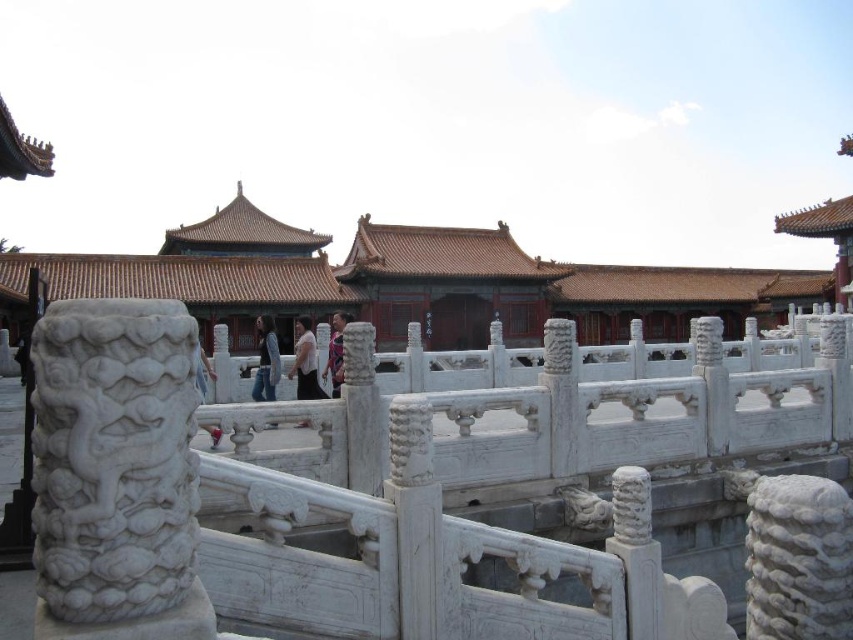
You are a photographer planning to take a photo of the dark blue jeans at center and the matte pink dress at center in this historical setting. Which object should you focus on first to ensure both are in the frame without moving the camera?

You should focus on the dark blue jeans at center first because it is in front of the matte pink dress at center, ensuring both will be captured in the frame without needing to adjust the camera position.

You are standing on the raised platform in front of the historical palace complex. You notice two points marked on the ground at coordinates point (318, 387) and point (267, 346). Which point is closer to you?

Point (318, 387) is closer to the viewer than point (267, 346).

You are a tourist visiting this historical site and want to take a photo of the light brown fabric shirt at center and dark blue jeans at center. Which one is located to the right in the image?

The light brown fabric shirt at center is positioned on the right side of dark blue jeans at center, so the light brown fabric shirt at center is located to the right in the image.